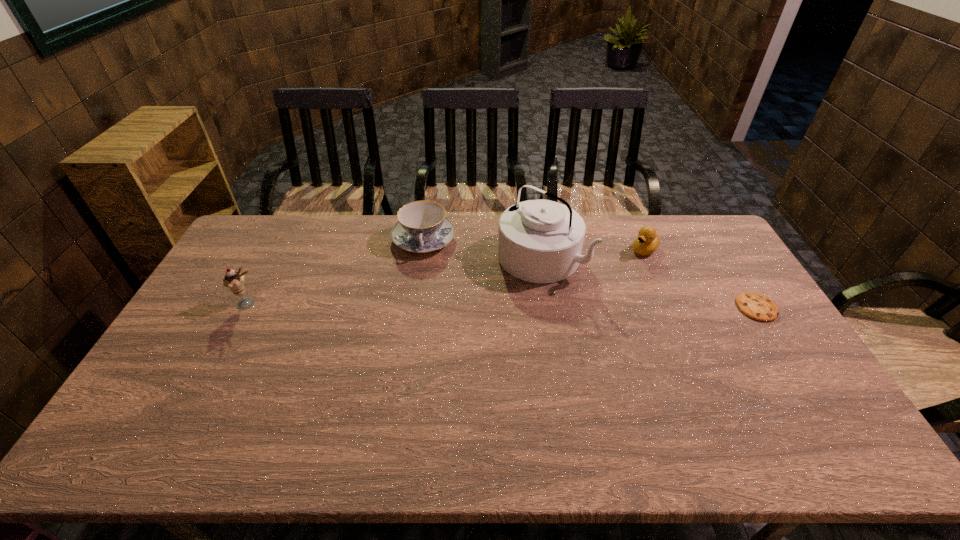
Image resolution: width=960 pixels, height=540 pixels. What are the coordinates of `duckling situated at the far edge` in the screenshot? It's located at (648, 240).

Where is `kettle at the far edge`? kettle at the far edge is located at coordinates (540, 241).

This screenshot has width=960, height=540. I want to click on object at the left edge, so click(x=234, y=281).

Locate an element on the screen. This screenshot has height=540, width=960. object that is at the right edge is located at coordinates (756, 306).

The height and width of the screenshot is (540, 960). I want to click on free space at the far edge, so click(x=610, y=236).

In the image, there is a desktop. Where is `free space at the near edge`? This screenshot has width=960, height=540. free space at the near edge is located at coordinates (491, 407).

This screenshot has width=960, height=540. In the image, there is a desktop. What are the coordinates of `free region at the left edge` in the screenshot? It's located at (223, 269).

Where is `vacant space at the right edge`? Image resolution: width=960 pixels, height=540 pixels. vacant space at the right edge is located at coordinates (742, 319).

The image size is (960, 540). In the image, there is a desktop. In order to click on free space at the far right corner in this screenshot , I will do pos(682,216).

The image size is (960, 540). In order to click on vacant space in between the duckling and the cookie in this screenshot , I will do `click(701, 279)`.